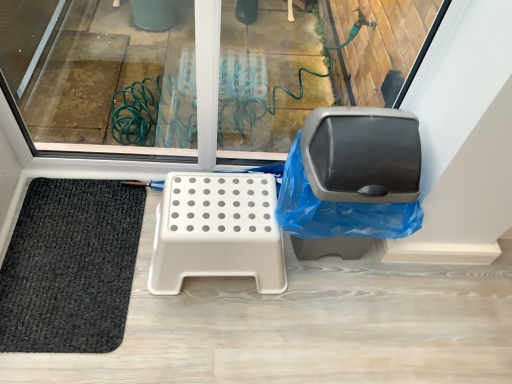
You are a GUI agent. You are given a task and a screenshot of the screen. Output one action in this format:
    pyautogui.click(x=<x>, y=<y>)
    Task: Click on the free space above beige plastic step stool at center (from a real-world perspective)
    Image resolution: width=512 pixels, height=384 pixels.
    Given the screenshot: What is the action you would take?
    pyautogui.click(x=220, y=206)